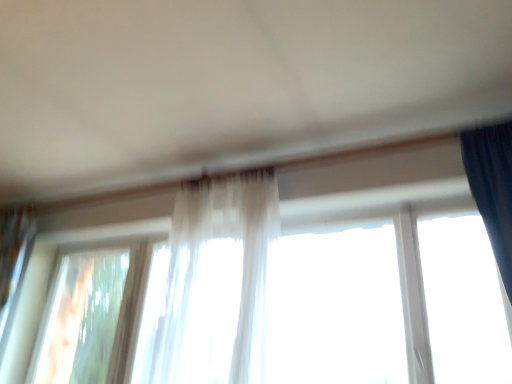
Question: Should I look upward or downward to see translucent fabric curtain at center?

Choices:
 (A) up
 (B) down

Answer: (B)

Question: Does translucent fabric curtain at center have a smaller size compared to transparent glass window at lower left, which is the first window in left-to-right order?

Choices:
 (A) yes
 (B) no

Answer: (B)

Question: Can you confirm if translucent fabric curtain at center is taller than transparent glass window at lower left, which is the first window in left-to-right order?

Choices:
 (A) yes
 (B) no

Answer: (A)

Question: Is translucent fabric curtain at center thinner than transparent glass window at lower left, which is the first window in left-to-right order?

Choices:
 (A) no
 (B) yes

Answer: (A)

Question: Is translucent fabric curtain at center to the right of transparent glass window at lower left, placed as the second window when sorted from right to left, from the viewer's perspective?

Choices:
 (A) no
 (B) yes

Answer: (B)

Question: From a real-world perspective, does translucent fabric curtain at center sit lower than transparent glass window at lower left, which is the first window in left-to-right order?

Choices:
 (A) no
 (B) yes

Answer: (A)

Question: From the image's perspective, is translucent fabric curtain at center beneath transparent glass window at lower left, which is the first window in left-to-right order?

Choices:
 (A) no
 (B) yes

Answer: (A)

Question: Is translucent fabric at center, acting as the 1th window starting from the right, to the left of translucent fabric curtain at center from the viewer's perspective?

Choices:
 (A) yes
 (B) no

Answer: (B)

Question: Does translucent fabric at center, which is the second window in left-to-right order, lie behind translucent fabric curtain at center?

Choices:
 (A) no
 (B) yes

Answer: (B)

Question: Is translucent fabric at center, which is the second window in left-to-right order, far from translucent fabric curtain at center?

Choices:
 (A) no
 (B) yes

Answer: (A)

Question: Could you tell me if translucent fabric at center, which is the second window in left-to-right order, is facing translucent fabric curtain at center?

Choices:
 (A) yes
 (B) no

Answer: (A)

Question: Considering the relative sizes of translucent fabric at center, which is the second window in left-to-right order, and translucent fabric curtain at center in the image provided, is translucent fabric at center, which is the second window in left-to-right order, thinner than translucent fabric curtain at center?

Choices:
 (A) yes
 (B) no

Answer: (A)

Question: Is translucent fabric at center, which is the second window in left-to-right order, positioned before translucent fabric curtain at center?

Choices:
 (A) yes
 (B) no

Answer: (B)

Question: From a real-world perspective, is translucent fabric at center, which is the second window in left-to-right order, under transparent glass window at lower left, which is the first window in left-to-right order?

Choices:
 (A) no
 (B) yes

Answer: (A)